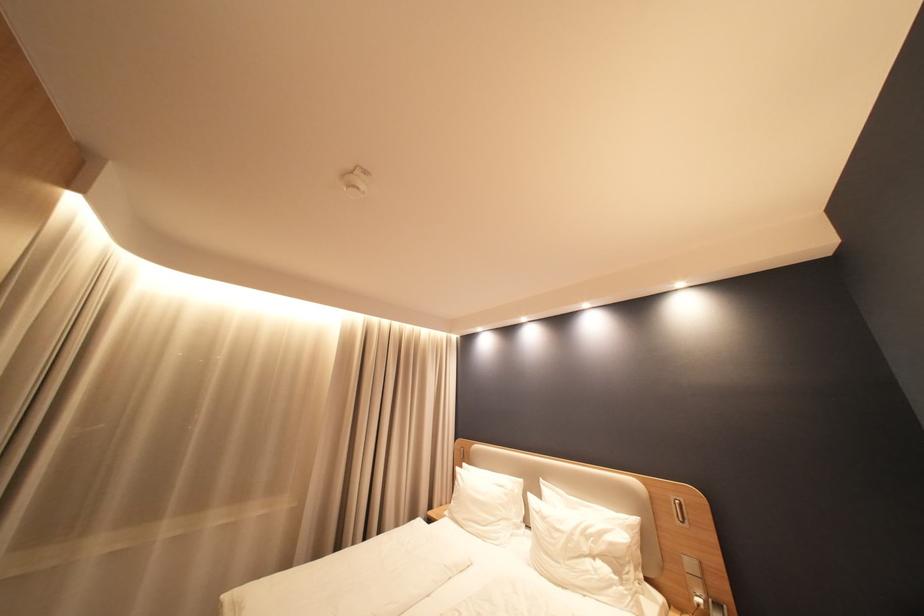
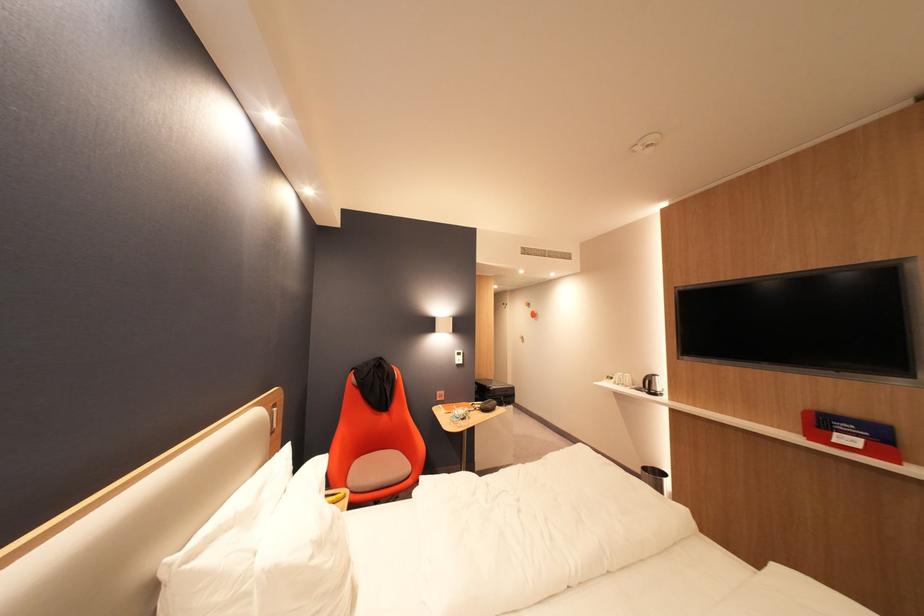
Locate, in the second image, the point that corresponds to (553,519) in the first image.

(330, 545)